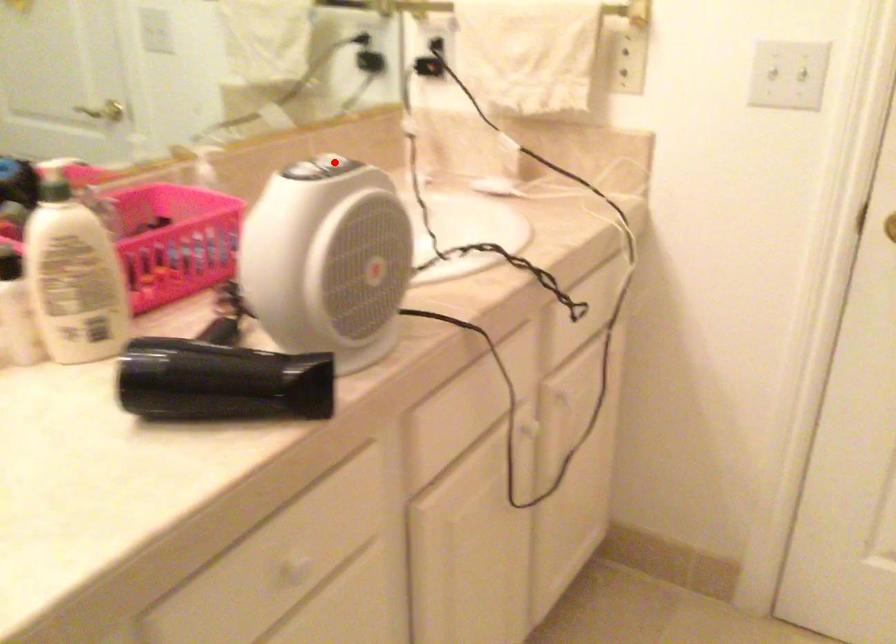
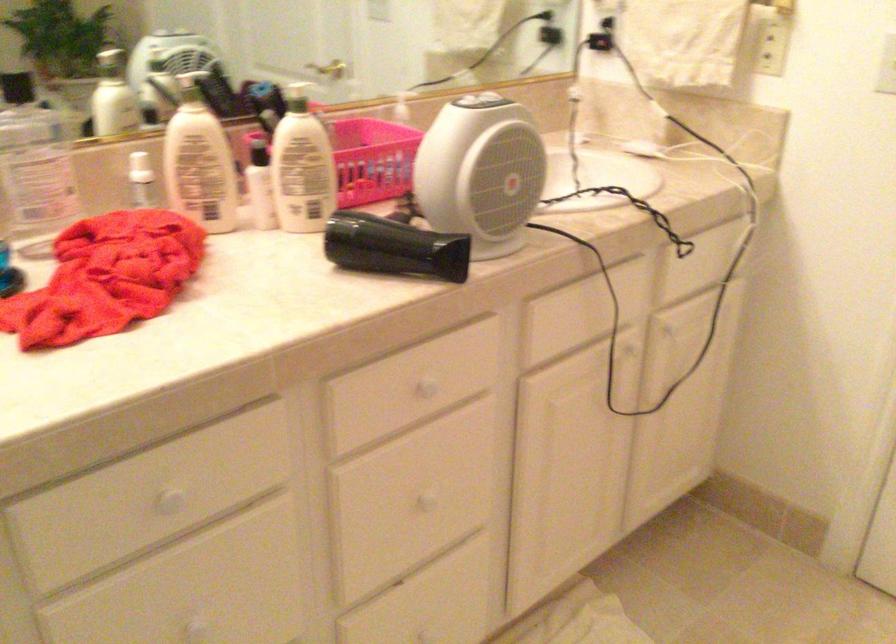
In the second image, find the point that corresponds to the highlighted location in the first image.

(484, 102)